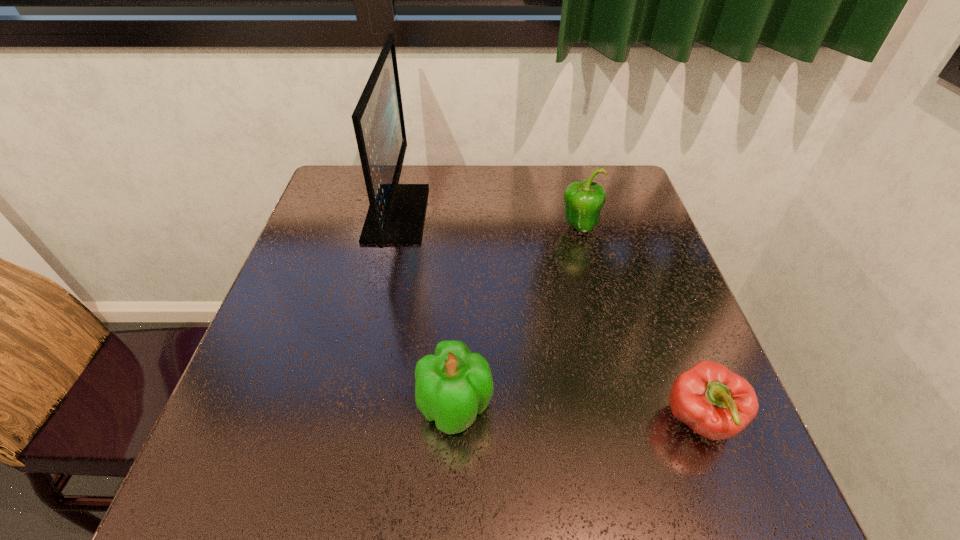
Identify the location of monitor. This screenshot has width=960, height=540. (396, 213).

This screenshot has height=540, width=960. I want to click on the tallest object, so click(x=396, y=213).

Locate an element on the screen. This screenshot has height=540, width=960. the farthest bell pepper is located at coordinates (583, 201).

The height and width of the screenshot is (540, 960). Find the location of `the second bell pepper from left to right`. the second bell pepper from left to right is located at coordinates (583, 201).

The height and width of the screenshot is (540, 960). Find the location of `the third object from right to left`. the third object from right to left is located at coordinates (452, 386).

The height and width of the screenshot is (540, 960). Find the location of `the shortest bell pepper`. the shortest bell pepper is located at coordinates (716, 403).

The image size is (960, 540). Identify the location of the rightmost bell pepper. (716, 403).

Find the location of a particular element. Image resolution: width=960 pixels, height=540 pixels. blank space located 0.120m on the screen side of the monitor is located at coordinates (469, 213).

Where is `free location located on the left of the second bell pepper from left to right`? This screenshot has width=960, height=540. free location located on the left of the second bell pepper from left to right is located at coordinates (517, 227).

Locate an element on the screen. The width and height of the screenshot is (960, 540). vacant space located on the left of the leftmost bell pepper is located at coordinates (296, 407).